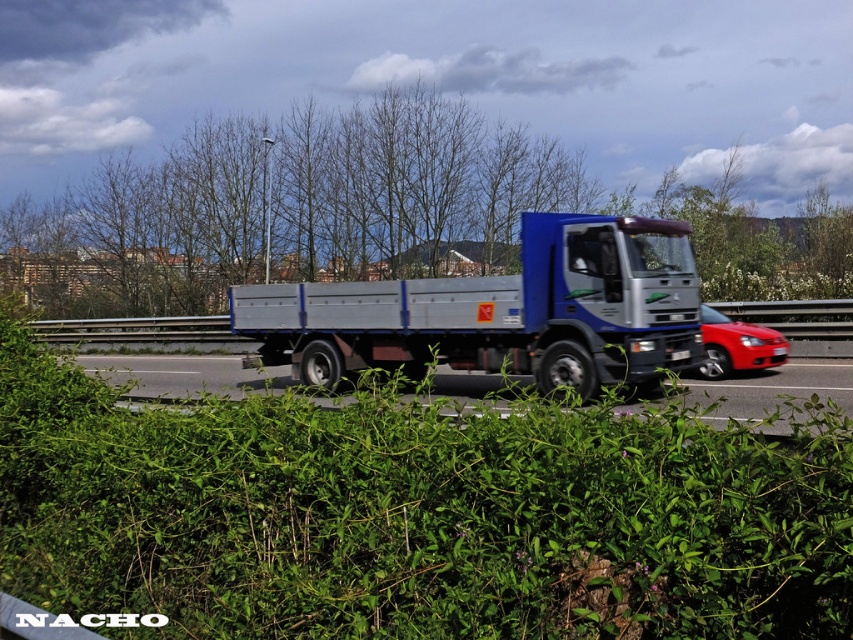
Question: Which point is closer to the camera?

Choices:
 (A) (91, 566)
 (B) (434, 307)

Answer: (A)

Question: Is bare branches at center smaller than metallic silver truck at center?

Choices:
 (A) no
 (B) yes

Answer: (A)

Question: In this image, where is green leafy hedge at center located relative to bare branches at center?

Choices:
 (A) below
 (B) above

Answer: (A)

Question: Which object is closer to the camera taking this photo?

Choices:
 (A) green leafy hedge at center
 (B) metallic silver trailer truck at center
 (C) metallic silver truck at center
 (D) bare branches at center

Answer: (A)

Question: Does bare branches at center come in front of shiny red car at right?

Choices:
 (A) no
 (B) yes

Answer: (B)

Question: Which point is farther to the camera?

Choices:
 (A) shiny red car at right
 (B) metallic silver truck at center
 (C) green leafy hedge at center
 (D) metallic silver trailer truck at center

Answer: (A)